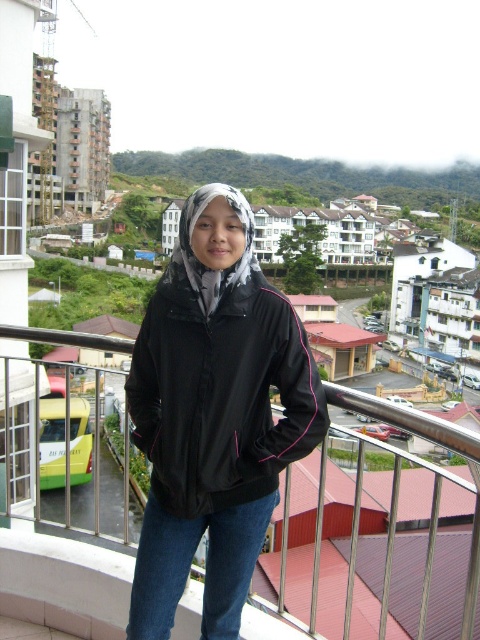
Measure the distance from blue denim jeans at lower center to metallic silver railing at upper center.

They are 7.79 meters apart.

Is blue denim jeans at lower center closer to the viewer compared to metallic silver railing at upper center?

No, blue denim jeans at lower center is further to the viewer.

Where is `blue denim jeans at lower center`? blue denim jeans at lower center is located at coordinates (64, 582).

Between black synthetic jacket at center and blue denim jeans at lower center, which one appears on the left side from the viewer's perspective?

blue denim jeans at lower center

Is point (143, 396) farther from camera compared to point (47, 589)?

Yes, point (143, 396) is behind point (47, 589).

The height and width of the screenshot is (640, 480). What are the coordinates of `black synthetic jacket at center` in the screenshot? It's located at (219, 376).

Is black synthetic jacket at center bigger than metallic silver railing at upper center?

No, black synthetic jacket at center is not bigger than metallic silver railing at upper center.

Does point (204, 266) come closer to viewer compared to point (429, 435)?

No, it is not.

This screenshot has width=480, height=640. What do you see at coordinates (219, 376) in the screenshot?
I see `black synthetic jacket at center` at bounding box center [219, 376].

Where is `black synthetic jacket at center`? black synthetic jacket at center is located at coordinates (219, 376).